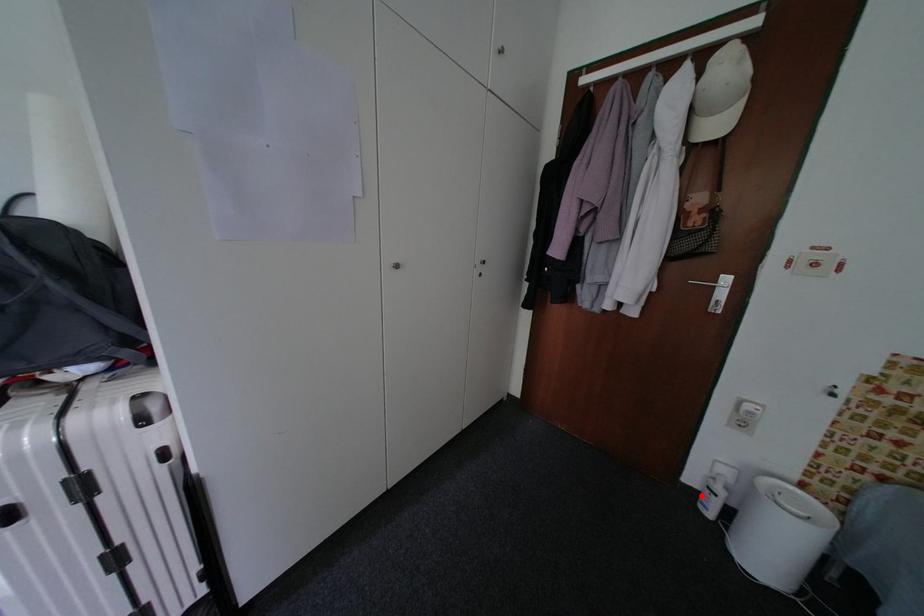
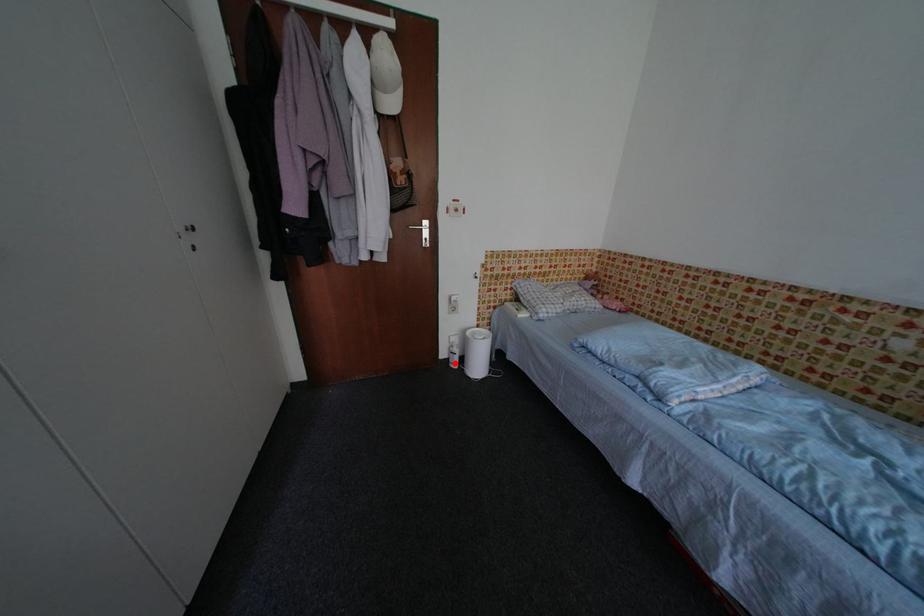
I am providing you with two images of the same scene from different viewpoints. A red point is marked on the first image and another point is marked on the second image. Does the point marked in image1 correspond to the same location as the one in image2?

Yes